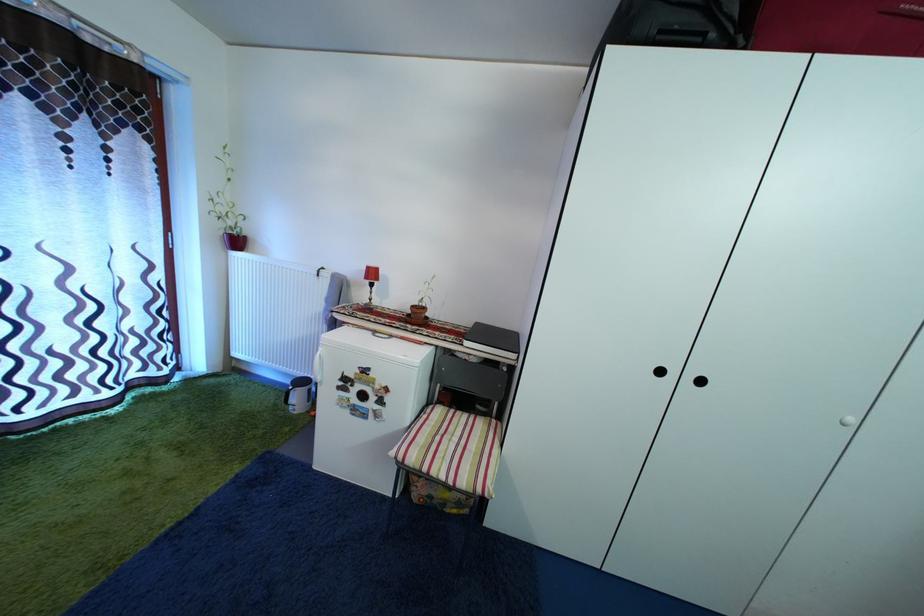
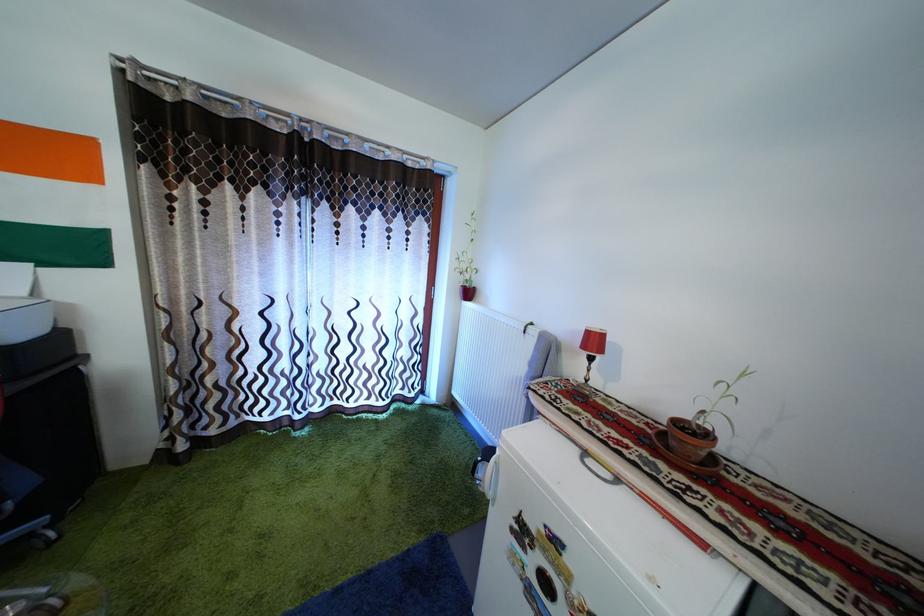
Find the pixel in the second image that matches point (377, 276) in the first image.

(598, 339)